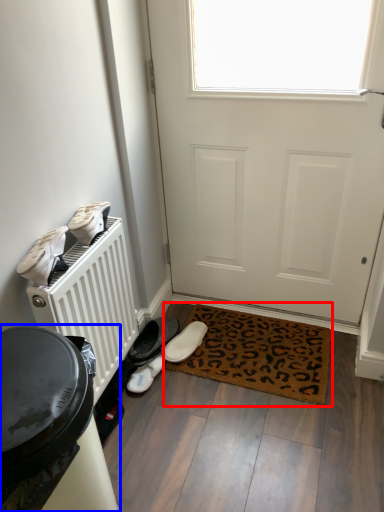
Question: Which object is closer to the camera taking this photo, mat (highlighted by a red box) or appliance (highlighted by a blue box)?

Choices:
 (A) mat
 (B) appliance

Answer: (B)